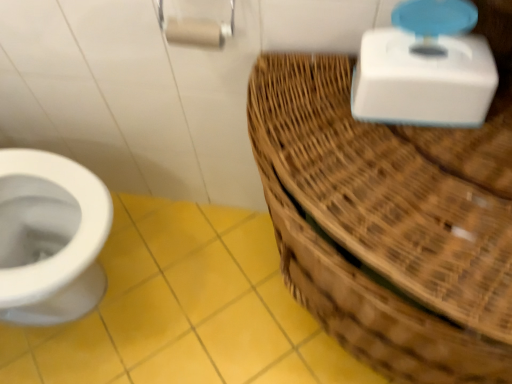
Question: Considering the positions of point (458, 69) and point (463, 240), is point (458, 69) closer or farther from the camera than point (463, 240)?

Choices:
 (A) farther
 (B) closer

Answer: (A)

Question: Would you say white plastic scale at upper right is to the left or to the right of woven brown basket at right in the picture?

Choices:
 (A) right
 (B) left

Answer: (A)

Question: Which object is positioned closest to the woven brown basket at right?

Choices:
 (A) white plastic scale at upper right
 (B) matte white toilet paper at upper center
 (C) yellow matte tile at lower left

Answer: (A)

Question: Which object is the farthest from the white plastic scale at upper right?

Choices:
 (A) matte white toilet paper at upper center
 (B) woven brown basket at right
 (C) yellow matte tile at lower left

Answer: (C)